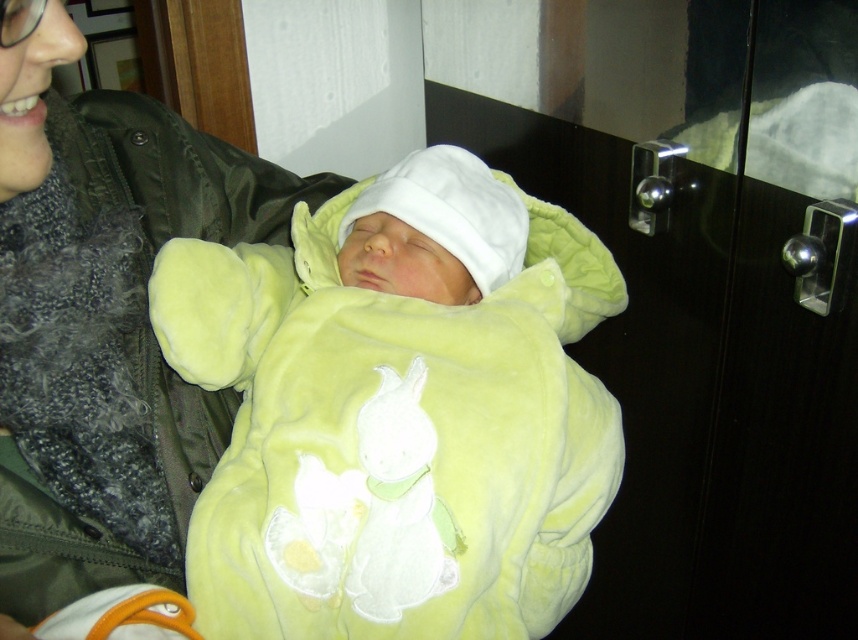
Does point (251, 298) come closer to viewer compared to point (68, 572)?

No, (251, 298) is further to viewer.

Consider the image. Does velvety yellow onesie at center appear on the left side of velvet green jacket at upper left?

No, velvety yellow onesie at center is not to the left of velvet green jacket at upper left.

Does point (421, 179) lie behind point (139, 188)?

Yes, it is.

Where is `velvety yellow onesie at center`? velvety yellow onesie at center is located at coordinates pyautogui.click(x=397, y=413).